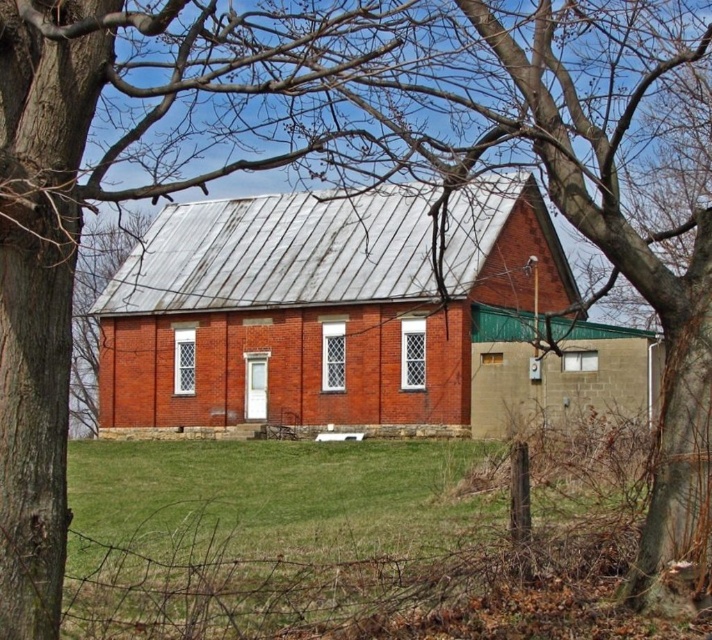
You are a gardener who needs to plant a row of flowers between the brick barn at center and the green grass at center. The row requires a minimum of 5 meters of space. Can you fit the flower row between them?

The brick barn at center and green grass at center are 7.63 meters apart, so yes, the flower row can be planted between them since the space is more than the required 5 meters.

You are a painter standing at the base of the brick barn at center and the green grass at center. You want to paint both objects. Which object will require you to look upwards more while painting?

The brick barn at center is much taller than the green grass at center, so you will need to look upwards more while painting the brick barn at center.